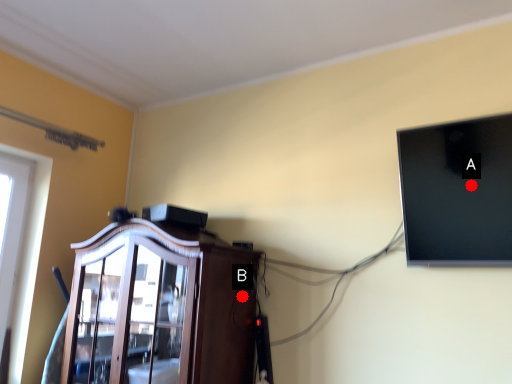
Question: Two points are circled on the image, labeled by A and B beside each circle. Which point is farther to the camera?

Choices:
 (A) A is further
 (B) B is further

Answer: (B)